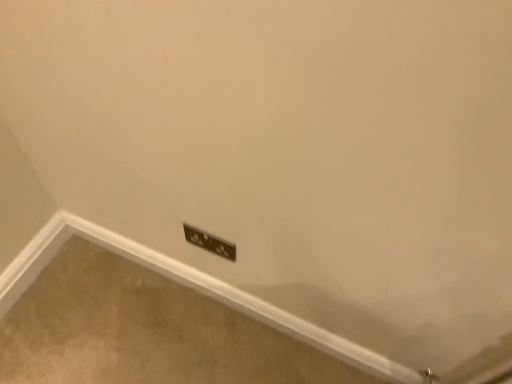
Where is `black plastic power plugs and sockets at lower center`? Image resolution: width=512 pixels, height=384 pixels. black plastic power plugs and sockets at lower center is located at coordinates (210, 242).

Describe the element at coordinates (210, 242) in the screenshot. I see `black plastic power plugs and sockets at lower center` at that location.

What do you see at coordinates (144, 332) in the screenshot? This screenshot has width=512, height=384. I see `metallic socket at lower center` at bounding box center [144, 332].

Measure the distance between metallic socket at lower center and camera.

metallic socket at lower center is 1.20 meters away from camera.

Locate an element on the screen. metallic socket at lower center is located at coordinates (144, 332).

I want to click on black plastic power plugs and sockets at lower center, so click(210, 242).

Would you say black plastic power plugs and sockets at lower center is to the left or to the right of metallic socket at lower center in the picture?

Based on their positions, black plastic power plugs and sockets at lower center is located to the left of metallic socket at lower center.

Between black plastic power plugs and sockets at lower center and metallic socket at lower center, which one is positioned behind?

Positioned behind is metallic socket at lower center.

Considering the points (231, 245) and (90, 244), which point is in front, point (231, 245) or point (90, 244)?

The point (231, 245) is in front.

From the image's perspective, relative to metallic socket at lower center, is black plastic power plugs and sockets at lower center above or below?

Clearly, from the image's perspective, black plastic power plugs and sockets at lower center is above metallic socket at lower center.

From a real-world perspective, is black plastic power plugs and sockets at lower center positioned under metallic socket at lower center based on gravity?

No.

Looking at their sizes, would you say black plastic power plugs and sockets at lower center is wider or thinner than metallic socket at lower center?

Considering their sizes, black plastic power plugs and sockets at lower center looks slimmer than metallic socket at lower center.

Is black plastic power plugs and sockets at lower center taller or shorter than metallic socket at lower center?

Clearly, black plastic power plugs and sockets at lower center is shorter compared to metallic socket at lower center.

Considering the sizes of objects black plastic power plugs and sockets at lower center and metallic socket at lower center in the image provided, who is bigger, black plastic power plugs and sockets at lower center or metallic socket at lower center?

metallic socket at lower center.

Is metallic socket at lower center surrounded by black plastic power plugs and sockets at lower center?

No, metallic socket at lower center is not surrounded by black plastic power plugs and sockets at lower center.

Are black plastic power plugs and sockets at lower center and metallic socket at lower center located far from each other?

No, black plastic power plugs and sockets at lower center is in close proximity to metallic socket at lower center.

Is black plastic power plugs and sockets at lower center positioned with its back to metallic socket at lower center?

No, black plastic power plugs and sockets at lower center is not facing the opposite direction of metallic socket at lower center.

Where is `concrete that is on the right side of black plastic power plugs and sockets at lower center`? concrete that is on the right side of black plastic power plugs and sockets at lower center is located at coordinates point(144,332).

Based on their positions, is metallic socket at lower center located to the left or right of black plastic power plugs and sockets at lower center?

From the image, it's evident that metallic socket at lower center is to the right of black plastic power plugs and sockets at lower center.

Does metallic socket at lower center come in front of black plastic power plugs and sockets at lower center?

No, metallic socket at lower center is further to the viewer.

Which is nearer, (77, 339) or (193, 240)?

Point (77, 339) appears to be farther away from the viewer than point (193, 240).

From the image's perspective, is metallic socket at lower center on black plastic power plugs and sockets at lower center?

No.

From a real-world perspective, which object rests below the other?

From a 3D spatial view, metallic socket at lower center is below.

Consider the image. Which of these two, metallic socket at lower center or black plastic power plugs and sockets at lower center, is thinner?

black plastic power plugs and sockets at lower center.

Which of these two, metallic socket at lower center or black plastic power plugs and sockets at lower center, stands shorter?

With less height is black plastic power plugs and sockets at lower center.

Consider the image. In terms of size, does metallic socket at lower center appear bigger or smaller than black plastic power plugs and sockets at lower center?

In the image, metallic socket at lower center appears to be larger than black plastic power plugs and sockets at lower center.

Is metallic socket at lower center located outside black plastic power plugs and sockets at lower center?

Absolutely, metallic socket at lower center is external to black plastic power plugs and sockets at lower center.

Looking at this image, is metallic socket at lower center positioned far away from black plastic power plugs and sockets at lower center?

Actually, metallic socket at lower center and black plastic power plugs and sockets at lower center are a little close together.

Is metallic socket at lower center oriented towards black plastic power plugs and sockets at lower center?

No, metallic socket at lower center is not aimed at black plastic power plugs and sockets at lower center.

How much distance is there between metallic socket at lower center and black plastic power plugs and sockets at lower center?

metallic socket at lower center is 16.90 inches away from black plastic power plugs and sockets at lower center.

I want to click on power plugs and sockets on the left of metallic socket at lower center, so click(x=210, y=242).

I want to click on power plugs and sockets above the metallic socket at lower center (from the image's perspective), so click(210, 242).

I want to click on concrete behind the black plastic power plugs and sockets at lower center, so 144,332.